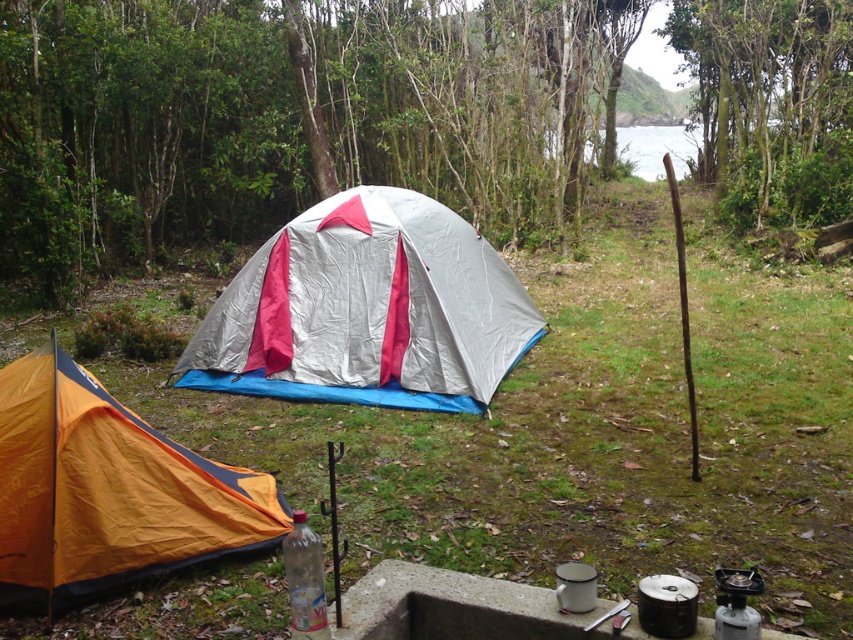
Question: Does silver/reflective tent at center appear on the right side of orange nylon tent at lower left?

Choices:
 (A) no
 (B) yes

Answer: (B)

Question: Does silver/reflective tent at center have a smaller size compared to orange nylon tent at lower left?

Choices:
 (A) no
 (B) yes

Answer: (A)

Question: Which of the following is the closest to the observer?

Choices:
 (A) silver/reflective tent at center
 (B) orange nylon tent at lower left

Answer: (B)

Question: Can you confirm if silver/reflective tent at center is smaller than orange nylon tent at lower left?

Choices:
 (A) no
 (B) yes

Answer: (A)